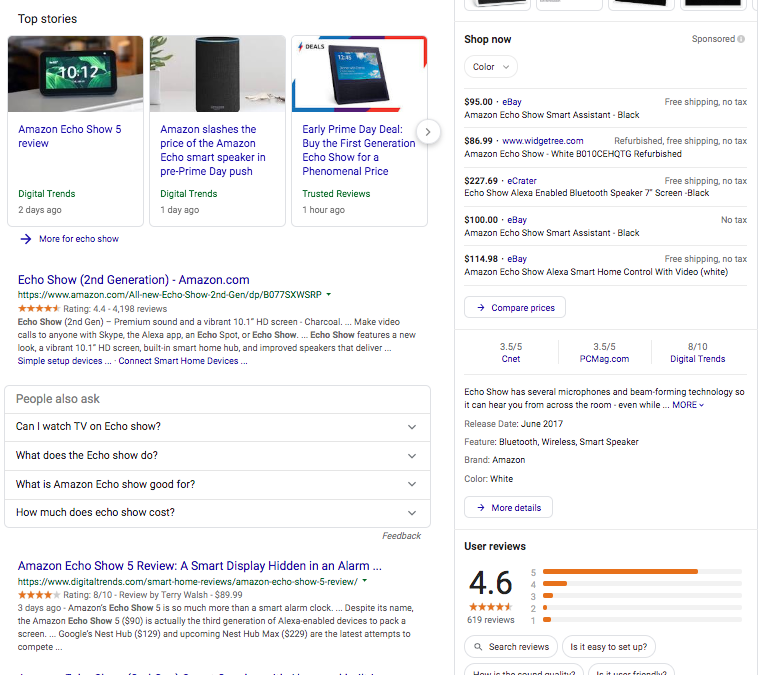
Image resolution: width=775 pixels, height=675 pixels. In order to click on amazon echo show 5 in this screenshot , I will do `click(73, 74)`.